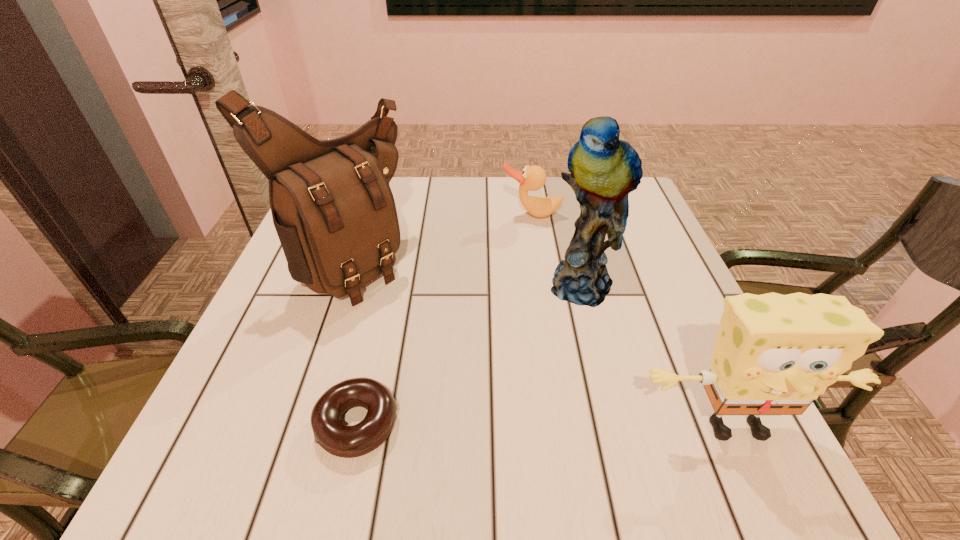
The height and width of the screenshot is (540, 960). Identify the location of free space on the desktop that is between the doughnut and the sponge and is positioned on the front-facing side of the shoulder bag. pos(599,426).

The width and height of the screenshot is (960, 540). What are the coordinates of `free space on the desktop that is between the shortest object and the sponge and is positioned on the beak of the fourth tallest object` in the screenshot? It's located at [x=523, y=425].

The image size is (960, 540). I want to click on free space on the desktop that is between the shortest object and the sponge and is positioned on the face of the parrot, so click(x=579, y=426).